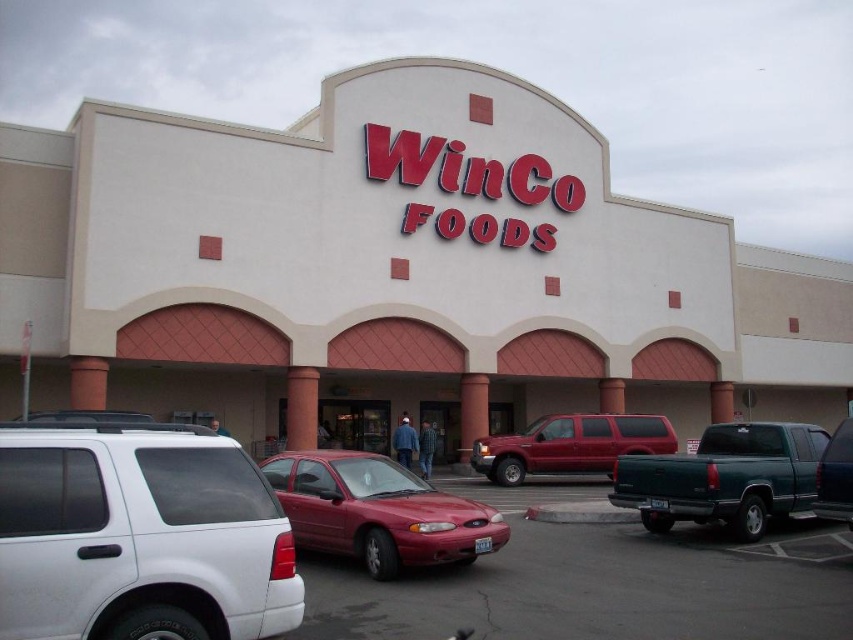
Locate an element on the screen. The width and height of the screenshot is (853, 640). metallic red car at center is located at coordinates (596, 584).

Where is `metallic red car at center`? The height and width of the screenshot is (640, 853). metallic red car at center is located at coordinates (596, 584).

Is white matte suv at lower left further to camera compared to metallic red car at center?

No.

Which is behind, point (61, 493) or point (525, 630)?

The point (525, 630) is behind.

Find the location of `white matte suv at lower left`. white matte suv at lower left is located at coordinates (138, 538).

Is shiny red suv at center in front of metallic dark green truck at right?

No, shiny red suv at center is further to the viewer.

Is shiny red suv at center to the right of metallic dark green truck at right from the viewer's perspective?

Incorrect, shiny red suv at center is not on the right side of metallic dark green truck at right.

The height and width of the screenshot is (640, 853). I want to click on shiny red suv at center, so click(x=570, y=445).